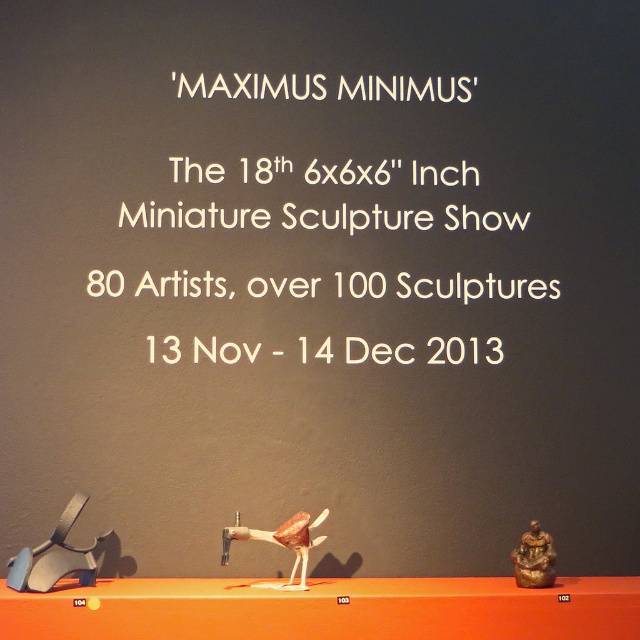
Question: Is matte black chair at lower left wider than metallic red bird at center?

Choices:
 (A) yes
 (B) no

Answer: (B)

Question: Is the position of white paper at center more distant than that of matte black chair at lower left?

Choices:
 (A) yes
 (B) no

Answer: (A)

Question: Is matte black chair at lower left further to camera compared to metallic red bird at center?

Choices:
 (A) no
 (B) yes

Answer: (A)

Question: Considering the real-world distances, which object is farthest from the metallic red bird at center?

Choices:
 (A) matte black chair at lower left
 (B) bronze statue at right
 (C) white paper at center

Answer: (C)

Question: Which point is closer to the camera taking this photo?

Choices:
 (A) (204, 346)
 (B) (301, 516)

Answer: (B)

Question: Which object is positioned farthest from the white paper at center?

Choices:
 (A) bronze statue at right
 (B) metallic red bird at center

Answer: (A)